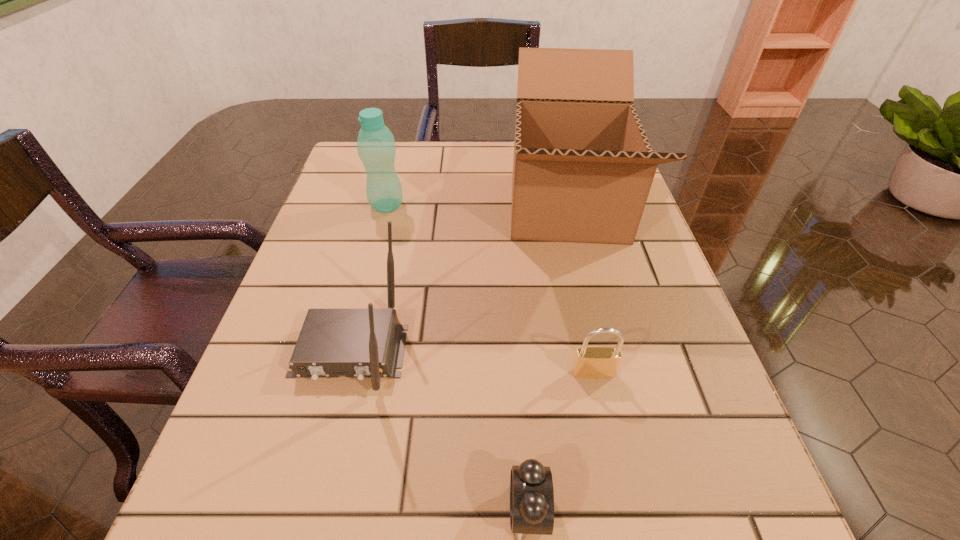
Identify the location of the tallest object. This screenshot has height=540, width=960. (583, 167).

Locate an element on the screen. The image size is (960, 540). bottle is located at coordinates (376, 147).

This screenshot has height=540, width=960. Identify the location of router. (360, 343).

Where is `padlock`? The width and height of the screenshot is (960, 540). padlock is located at coordinates (593, 362).

Where is `free location located on the front of the tallest object`? free location located on the front of the tallest object is located at coordinates (599, 343).

Find the location of a particular element. This screenshot has width=960, height=540. vacant space situated on the right of the bottle is located at coordinates (434, 206).

The height and width of the screenshot is (540, 960). I want to click on free region located 0.140m on the back of the router to connect cables, so click(x=314, y=492).

Locate an element on the screen. The image size is (960, 540). vacant space situated on the front-facing side of the fourth tallest object is located at coordinates (603, 420).

Locate an element on the screen. The height and width of the screenshot is (540, 960). object positioned at the far edge is located at coordinates (583, 167).

At what (x,y) coordinates should I click in order to perform the action: click on bottle located at the left edge. Please return your answer as a coordinate pair (x, y). The image size is (960, 540). Looking at the image, I should click on (376, 147).